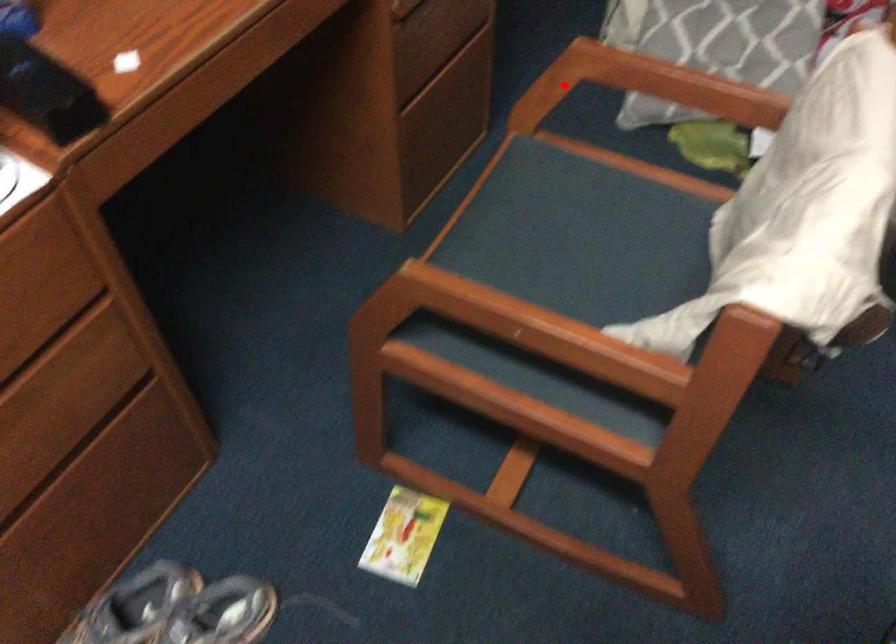
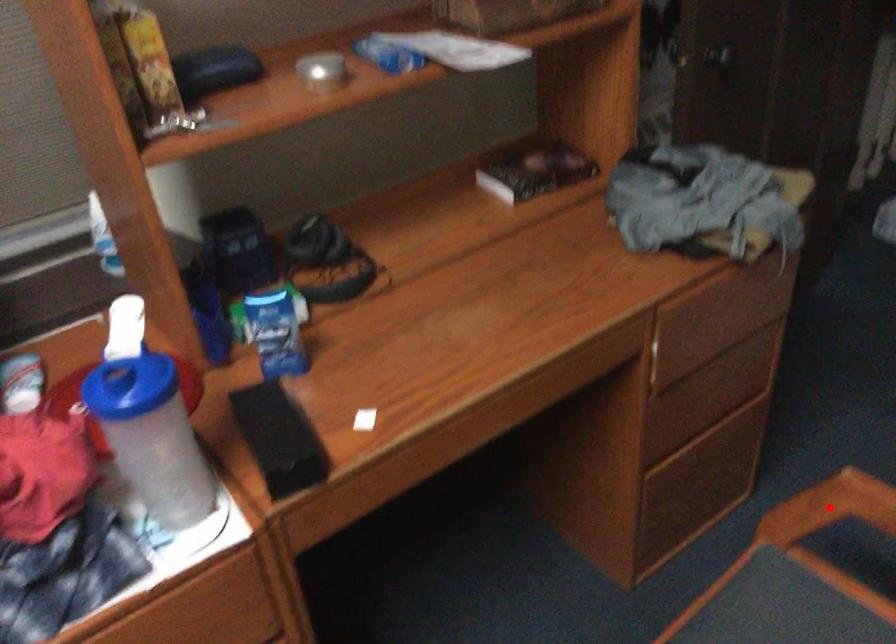
I am providing you with two images of the same scene from different viewpoints. A red point is marked on the first image and another point is marked on the second image. Is the red point in image1 aligned with the point shown in image2?

Yes